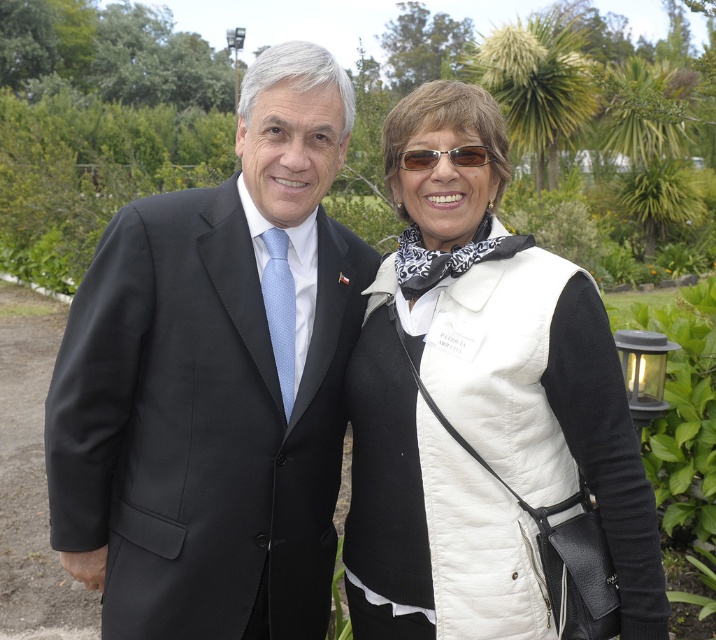
Question: Which point is closer to the camera taking this photo?

Choices:
 (A) (435, 124)
 (B) (106, 456)

Answer: (B)

Question: Can you confirm if black matte suit at center is bigger than white quilted vest at center?

Choices:
 (A) yes
 (B) no

Answer: (A)

Question: Is black matte suit at center to the left of white quilted vest at center from the viewer's perspective?

Choices:
 (A) yes
 (B) no

Answer: (A)

Question: Is black matte suit at center smaller than white quilted vest at center?

Choices:
 (A) yes
 (B) no

Answer: (B)

Question: Which of the following is the farthest from the observer?

Choices:
 (A) (150, 557)
 (B) (621, 515)

Answer: (A)